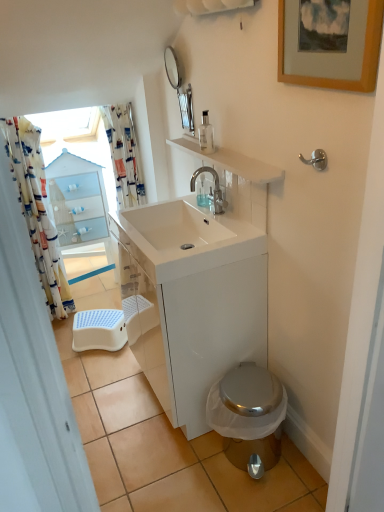
Where is `free space above printed fabric shower curtain at upper left, the first shower curtain from the right (from a real-world perspective)`? The width and height of the screenshot is (384, 512). free space above printed fabric shower curtain at upper left, the first shower curtain from the right (from a real-world perspective) is located at coordinates (118, 102).